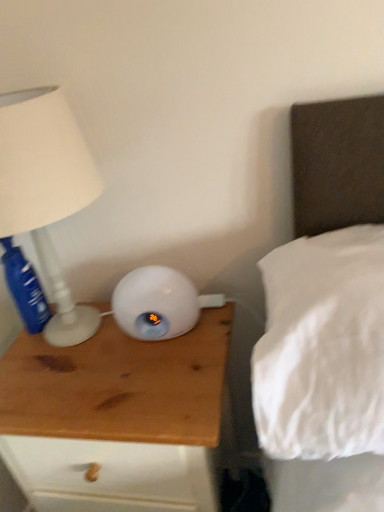
Question: Considering the positions of white matte lamp at left and blue plastic bottle at left in the image, is white matte lamp at left wider or thinner than blue plastic bottle at left?

Choices:
 (A) wide
 (B) thin

Answer: (A)

Question: From the image's perspective, is white matte lamp at left above or below blue plastic bottle at left?

Choices:
 (A) below
 (B) above

Answer: (B)

Question: Which of these objects is positioned farthest from the white matte lamp at left?

Choices:
 (A) white soft pillow at upper right
 (B) blue plastic bottle at left
 (C) wooden nightstand at left

Answer: (A)

Question: Based on their relative distances, which object is nearer to the wooden nightstand at left?

Choices:
 (A) white matte lamp at left
 (B) white soft pillow at upper right
 (C) blue plastic bottle at left

Answer: (A)